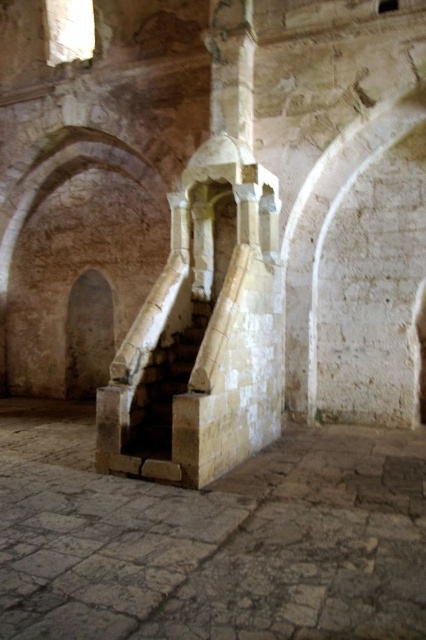
Question: Which point is closer to the camera?

Choices:
 (A) (158, 458)
 (B) (236, 483)

Answer: (B)

Question: Is stone stairs at center positioned behind stone textured stairs at center?

Choices:
 (A) no
 (B) yes

Answer: (A)

Question: Considering the relative positions of stone stairs at center and stone textured stairs at center in the image provided, where is stone stairs at center located with respect to stone textured stairs at center?

Choices:
 (A) left
 (B) right

Answer: (B)

Question: Which point is farther to the camera?

Choices:
 (A) (284, 596)
 (B) (157, 416)

Answer: (B)

Question: Is stone stairs at center to the left of stone textured stairs at center from the viewer's perspective?

Choices:
 (A) no
 (B) yes

Answer: (A)